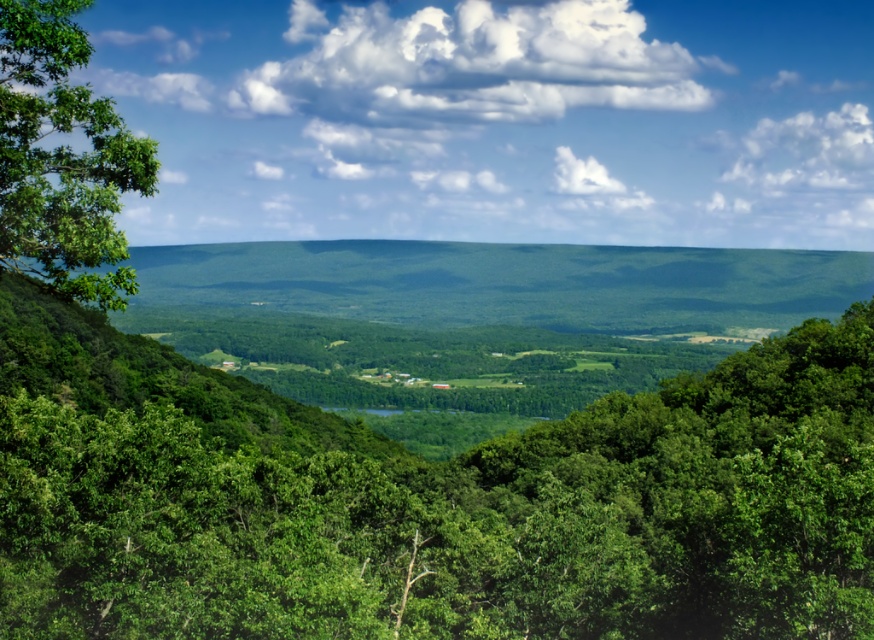
You are standing in the landscape and want to determine which of the two points, point (88,634) or point (864,177), is nearer to you. Based on the scene description, which point is closer?

Point (88,634) is closer to the viewer than point (864,177).

You are a landscape painter standing in the valley and want to paint the scene. You notice the white fluffy cloud at upper center and the green leafy tree at left. Which object is farther away from you?

The white fluffy cloud at upper center is farther away from you than the green leafy tree at left because it is 2094.90 feet away.

You are standing in the middle of the forest and see the point marked at coordinates (463,516). What is located at that point?

The point at coordinates (463,516) marks a green leafy tree at center.